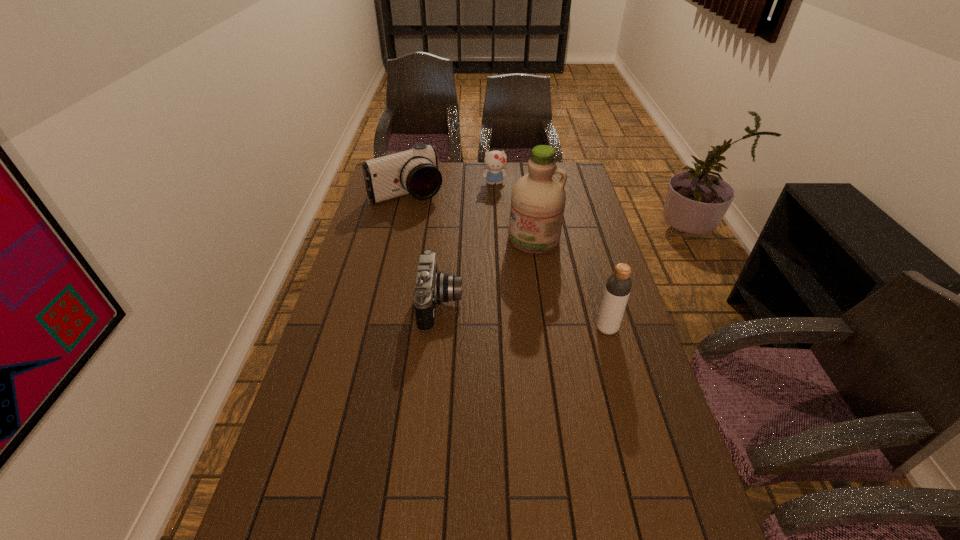
Where is `vacant area that lies between the third tallest object and the camera`? vacant area that lies between the third tallest object and the camera is located at coordinates (424, 249).

At what (x,y) coordinates should I click in order to perform the action: click on free space between the bottle and the kitten. Please return your answer as a coordinate pair (x, y). Looking at the image, I should click on (551, 256).

I want to click on vacant point located between the camera and the camcorder, so (x=424, y=249).

This screenshot has width=960, height=540. In order to click on vacant space in between the camera and the tallest object in this screenshot , I will do `click(488, 272)`.

Identify the location of free space between the kitten and the camera. (468, 244).

At what (x,y) coordinates should I click in order to perform the action: click on free spot between the kitten and the camcorder. Please return your answer as a coordinate pair (x, y). The width and height of the screenshot is (960, 540). Looking at the image, I should click on (450, 188).

This screenshot has width=960, height=540. I want to click on vacant area that lies between the kitten and the second tallest object, so click(551, 256).

Locate which object ranks fourth in proximity to the camera. Please provide its 2D coordinates. Your answer should be formatted as a tuple, i.e. [(x, y)], where the tuple contains the x and y coordinates of a point satisfying the conditions above.

[(495, 161)]

Identify which object is the closest to the third tallest object. Please provide its 2D coordinates. Your answer should be formatted as a tuple, i.e. [(x, y)], where the tuple contains the x and y coordinates of a point satisfying the conditions above.

[(495, 161)]

What are the coordinates of `free spot that satisfies the following two spatial constraints: 1. on the front side of the third tallest object; 2. on the front-facing side of the camera` in the screenshot? It's located at (381, 305).